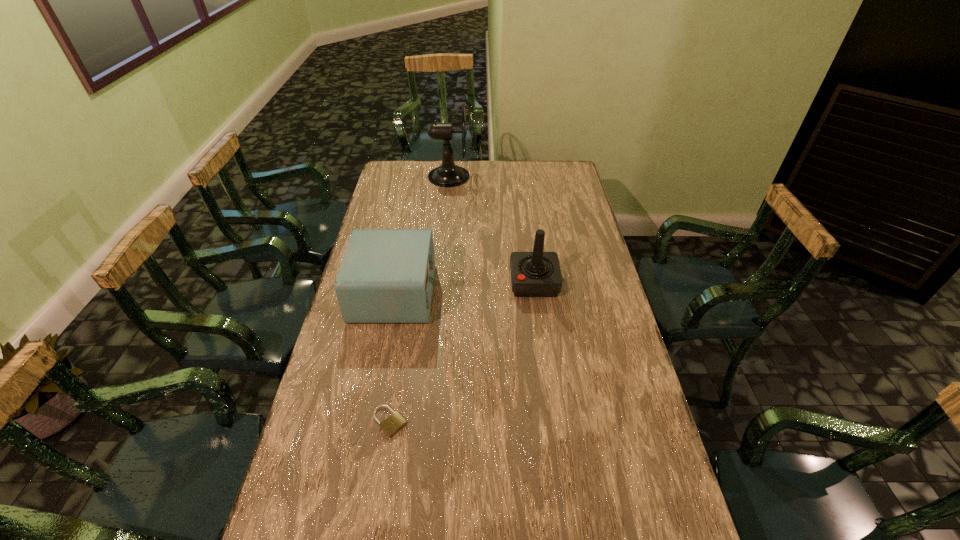
Locate an element on the screen. The width and height of the screenshot is (960, 540). free area in between the nearest object and the joystick is located at coordinates (462, 352).

You are a GUI agent. You are given a task and a screenshot of the screen. Output one action in this format:
    pyautogui.click(x=<x>, y=<y>)
    Task: Click on the free space between the padlock and the rightmost object
    
    Given the screenshot: What is the action you would take?
    pyautogui.click(x=462, y=352)

The width and height of the screenshot is (960, 540). I want to click on vacant area that lies between the third shortest object and the tallest object, so click(x=493, y=230).

Image resolution: width=960 pixels, height=540 pixels. Find the location of `empty location between the third tallest object and the rightmost object`. empty location between the third tallest object and the rightmost object is located at coordinates (464, 287).

The image size is (960, 540). I want to click on vacant point located between the tallest object and the joystick, so click(x=493, y=230).

This screenshot has height=540, width=960. I want to click on empty location between the joystick and the radio receiver, so pyautogui.click(x=464, y=287).

Locate which object is the third closest to the padlock. Please provide its 2D coordinates. Your answer should be formatted as a tuple, i.e. [(x, y)], where the tuple contains the x and y coordinates of a point satisfying the conditions above.

[(448, 174)]

Select which object appears as the closest to the tallest object. Please provide its 2D coordinates. Your answer should be formatted as a tuple, i.e. [(x, y)], where the tuple contains the x and y coordinates of a point satisfying the conditions above.

[(386, 275)]

Locate an element on the screen. The image size is (960, 540). vacant area that satisfies the following two spatial constraints: 1. on the front panel of the radio receiver; 2. on the back side of the shortest object is located at coordinates (368, 422).

Locate an element on the screen. free space that satisfies the following two spatial constraints: 1. on the front panel of the padlock; 2. on the right side of the third tallest object is located at coordinates (368, 422).